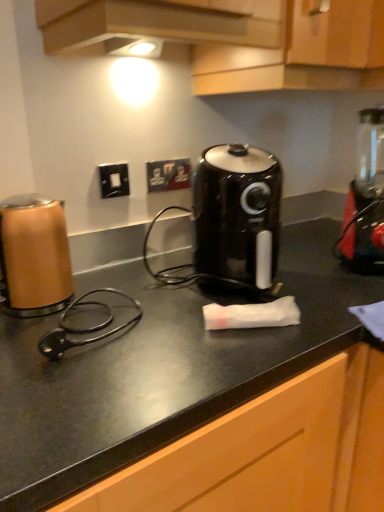
Locate an element on the screen. free spot below copper metallic kettle at left (from a real-world perspective) is located at coordinates (38, 313).